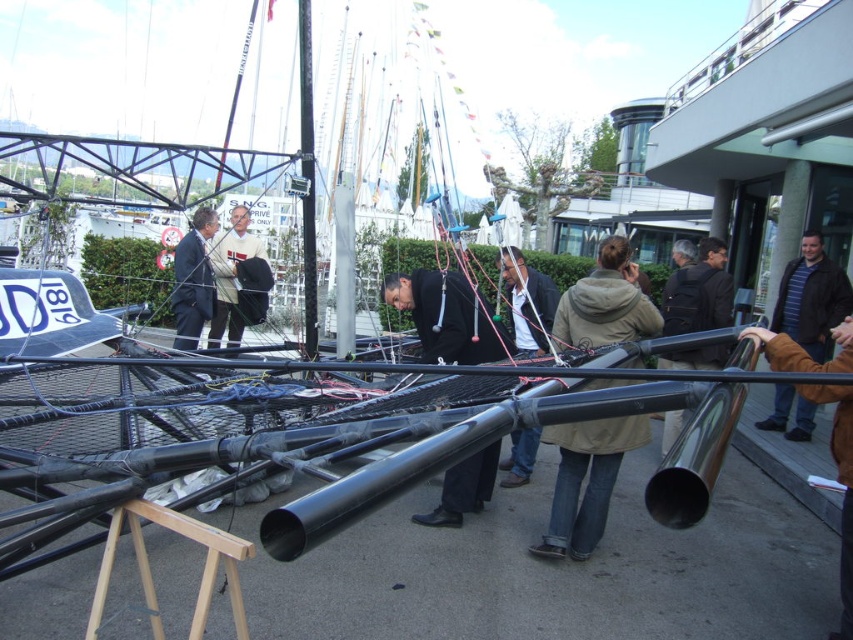
You are a photographer positioned to the left of the matte black jacket at center and the black matte pole at center. You want to capture a photo where both objects are in frame. Which object should you position closer to the camera to ensure both are fully visible?

Since the matte black jacket at center is not as tall as the black matte pole at center, you should position the matte black jacket at center closer to the camera. This way, the shorter jacket will occupy more of the frame, while the taller pole will still be visible in the background.

You are a photographer trying to capture a group photo of the people at the marina. You notice the khaki fabric jacket at center and the brown leather jacket at lower right. Which jacket should you focus on if you want to include both in the frame without cropping either?

To include both the khaki fabric jacket at center and the brown leather jacket at lower right in the frame without cropping, focus on the khaki fabric jacket at center since it is positioned to the left of the brown leather jacket at lower right, allowing both to be captured in a single shot.